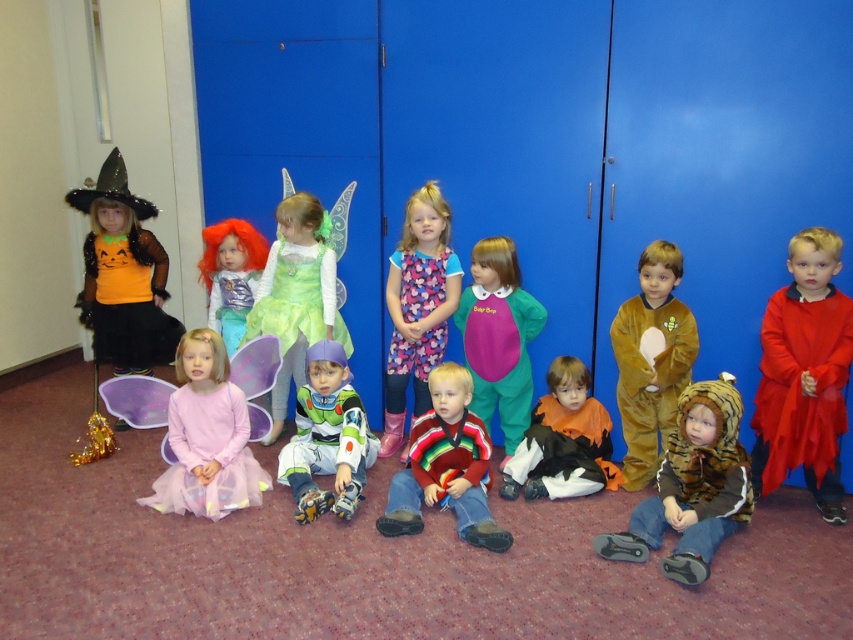
What are the coordinates of the matte purple costume at center?

The coordinates of the matte purple costume at center are at point (498, 337).

You are a photographer trying to capture a photo of the striped fur coat at lower center and the striped sweater at center. Since you can only focus on one object at a time, which one should you focus on first if you want to capture both in a single shot without moving the camera?

You should focus on the striped sweater at center first because the striped fur coat at lower center is to the right of it, so keeping the camera steady and focusing on the central object allows both to be in frame.

You are a photographer setting up for a group photo. You notice the striped fur coat at lower center and the velvet brown tiger costume at center. Which costume is closer to the camera?

The striped fur coat at lower center is closer to the camera because it is in front of the velvet brown tiger costume at center.